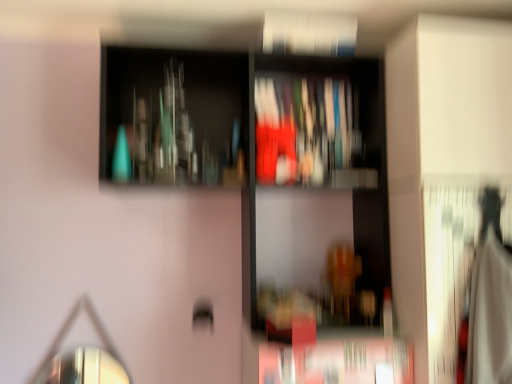
What is the approximate height of shiny metallic mirror at lower left?

The height of shiny metallic mirror at lower left is 14.12 inches.

What do you see at coordinates (83, 356) in the screenshot? This screenshot has width=512, height=384. I see `shiny metallic mirror at lower left` at bounding box center [83, 356].

Describe the element at coordinates (305, 130) in the screenshot. This screenshot has width=512, height=384. I see `matte plastic book at center, the 2th book in the front-to-back sequence` at that location.

Identify the location of matte glass bottles at upper center. (247, 134).

Based on the photo, is white paper book at upper center, the 1th book positioned from the top, spatially inside shiny metallic mirror at lower left, or outside of it?

white paper book at upper center, the 1th book positioned from the top, is spatially situated outside shiny metallic mirror at lower left.

Between white paper book at upper center, the 1th book positioned from the top, and shiny metallic mirror at lower left, which one appears on the right side from the viewer's perspective?

white paper book at upper center, the 1th book positioned from the top, is more to the right.

Can you tell me how much white paper book at upper center, the 1th book positioned from the top, and shiny metallic mirror at lower left differ in facing direction?

white paper book at upper center, the 1th book positioned from the top, and shiny metallic mirror at lower left are facing 0.00997 degrees away from each other.

Considering the relative sizes of white paper book at upper center, the 2th book positioned from the bottom, and shiny metallic mirror at lower left in the image provided, is white paper book at upper center, the 2th book positioned from the bottom, smaller than shiny metallic mirror at lower left?

Indeed, white paper book at upper center, the 2th book positioned from the bottom, has a smaller size compared to shiny metallic mirror at lower left.

Can you confirm if matte plastic book at center, the 2th book in the front-to-back sequence, is bigger than matte glass bottles at upper center?

Actually, matte plastic book at center, the 2th book in the front-to-back sequence, might be smaller than matte glass bottles at upper center.

Is matte plastic book at center, the 2th book in the front-to-back sequence, surrounding matte glass bottles at upper center?

No.

Is matte plastic book at center, which is the second book from top to bottom, oriented towards matte glass bottles at upper center?

Yes, matte plastic book at center, which is the second book from top to bottom, faces towards matte glass bottles at upper center.

Is matte plastic book at center, which is the second book from top to bottom, taller than matte glass bottles at upper center?

No, matte plastic book at center, which is the second book from top to bottom, is not taller than matte glass bottles at upper center.

From the image's perspective, between white paper book at upper center, the 2th book positioned from the bottom, and matte glass bottles at upper center, which one is located above?

white paper book at upper center, the 2th book positioned from the bottom, appears higher in the image.

Considering the relative sizes of white paper book at upper center, the 1th book positioned from the top, and matte glass bottles at upper center in the image provided, is white paper book at upper center, the 1th book positioned from the top, bigger than matte glass bottles at upper center?

Incorrect, white paper book at upper center, the 1th book positioned from the top, is not larger than matte glass bottles at upper center.

Which is behind, white paper book at upper center, the 2th book positioned from the bottom, or matte glass bottles at upper center?

white paper book at upper center, the 2th book positioned from the bottom, is further away from the camera.

From a real-world perspective, which book is the 2nd one above the matte glass bottles at upper center? Please provide its 2D coordinates.

[(309, 34)]

Is shiny metallic mirror at lower left spatially inside white paper book at upper center, acting as the first book starting from the front, or outside of it?

shiny metallic mirror at lower left is located beyond the bounds of white paper book at upper center, acting as the first book starting from the front.

What's the angular difference between shiny metallic mirror at lower left and white paper book at upper center, the second book viewed from the back,'s facing directions?

0.00997 degrees separate the facing orientations of shiny metallic mirror at lower left and white paper book at upper center, the second book viewed from the back.

Considering the positions of point (117, 377) and point (269, 36), is point (117, 377) closer or farther from the camera than point (269, 36)?

Clearly, point (117, 377) is more distant from the camera than point (269, 36).

From the image's perspective, does shiny metallic mirror at lower left appear higher than white paper book at upper center, acting as the first book starting from the front?

No, from the image's perspective, shiny metallic mirror at lower left is not on top of white paper book at upper center, acting as the first book starting from the front.

Is the position of matte glass bottles at upper center more distant than that of matte plastic book at center, the 1th book in the back-to-front sequence?

No.

Is matte glass bottles at upper center aimed at matte plastic book at center, the 1th book in the back-to-front sequence?

Yes.

Does point (124, 95) appear closer or farther from the camera than point (355, 136)?

Point (124, 95).

Would you say matte glass bottles at upper center is outside matte plastic book at center, the 1th book in the back-to-front sequence?

Indeed, matte glass bottles at upper center is completely outside matte plastic book at center, the 1th book in the back-to-front sequence.

Is matte plastic book at center, the 2th book in the front-to-back sequence, to the right of white paper book at upper center, the second book viewed from the back, from the viewer's perspective?

Yes.

Which is in front, point (307, 78) or point (354, 31)?

The point (354, 31) is in front.

Could you tell me if matte plastic book at center, the 2th book in the front-to-back sequence, is turned towards white paper book at upper center, the 1th book positioned from the top?

No, matte plastic book at center, the 2th book in the front-to-back sequence, does not turn towards white paper book at upper center, the 1th book positioned from the top.

Relative to white paper book at upper center, the second book viewed from the back, is matte plastic book at center, acting as the first book starting from the bottom, in front or behind?

Clearly, matte plastic book at center, acting as the first book starting from the bottom, is behind white paper book at upper center, the second book viewed from the back.

Looking at this image, is shiny metallic mirror at lower left in contact with matte glass bottles at upper center?

They are not placed beside each other.

Measure the distance between shiny metallic mirror at lower left and matte glass bottles at upper center.

shiny metallic mirror at lower left and matte glass bottles at upper center are 90.50 centimeters apart.

Is point (115, 370) positioned behind point (187, 65)?

No, (115, 370) is in front of (187, 65).

Considering the relative sizes of shiny metallic mirror at lower left and matte glass bottles at upper center in the image provided, is shiny metallic mirror at lower left bigger than matte glass bottles at upper center?

Incorrect, shiny metallic mirror at lower left is not larger than matte glass bottles at upper center.

There is a shiny metallic mirror at lower left. Where is `the 2nd book above it (from a real-world perspective)`? the 2nd book above it (from a real-world perspective) is located at coordinates point(309,34).

There is a matte glass bottles at upper center. In order to click on the 1st book above it (from the image's perspective) in this screenshot , I will do `click(305, 130)`.

From the image, which object appears to be nearer to shiny metallic mirror at lower left, matte plastic book at center, the 1th book in the back-to-front sequence, or matte glass bottles at upper center?

Among the two, matte glass bottles at upper center is located nearer to shiny metallic mirror at lower left.

Considering their positions, is shiny metallic mirror at lower left positioned further to matte plastic book at center, acting as the first book starting from the bottom, than white paper book at upper center, acting as the first book starting from the front?

shiny metallic mirror at lower left lies further to matte plastic book at center, acting as the first book starting from the bottom, than the other object.

Estimate the real-world distances between objects in this image. Which object is closer to matte plastic book at center, acting as the first book starting from the bottom, shiny metallic mirror at lower left or matte glass bottles at upper center?

matte glass bottles at upper center.

Which object lies further to the anchor point white paper book at upper center, the second book viewed from the back, matte plastic book at center, acting as the first book starting from the bottom, or shiny metallic mirror at lower left?

shiny metallic mirror at lower left.

Looking at the image, which one is located further to shiny metallic mirror at lower left, matte glass bottles at upper center or white paper book at upper center, the 2th book positioned from the bottom?

white paper book at upper center, the 2th book positioned from the bottom, is positioned further to the anchor shiny metallic mirror at lower left.

Considering their positions, is matte glass bottles at upper center positioned closer to matte plastic book at center, the 1th book in the back-to-front sequence, than white paper book at upper center, the second book viewed from the back?

matte glass bottles at upper center is closer to matte plastic book at center, the 1th book in the back-to-front sequence.

Which object lies nearer to the anchor point white paper book at upper center, acting as the first book starting from the front, matte glass bottles at upper center or shiny metallic mirror at lower left?

matte glass bottles at upper center.

From the image, which object appears to be farther from shiny metallic mirror at lower left, matte glass bottles at upper center or matte plastic book at center, the 1th book in the back-to-front sequence?

matte plastic book at center, the 1th book in the back-to-front sequence.

Image resolution: width=512 pixels, height=384 pixels. In order to click on bookcase between shiny metallic mirror at lower left and matte plastic book at center, which is the second book from top to bottom in this screenshot , I will do [247, 134].

The image size is (512, 384). I want to click on book between white paper book at upper center, the 1th book positioned from the top, and shiny metallic mirror at lower left from top to bottom, so click(305, 130).

The height and width of the screenshot is (384, 512). In order to click on bookcase between white paper book at upper center, the second book viewed from the back, and shiny metallic mirror at lower left from top to bottom in this screenshot , I will do `click(247, 134)`.

Where is `book that lies between white paper book at upper center, the 1th book positioned from the top, and matte glass bottles at upper center from top to bottom`? book that lies between white paper book at upper center, the 1th book positioned from the top, and matte glass bottles at upper center from top to bottom is located at coordinates (305, 130).